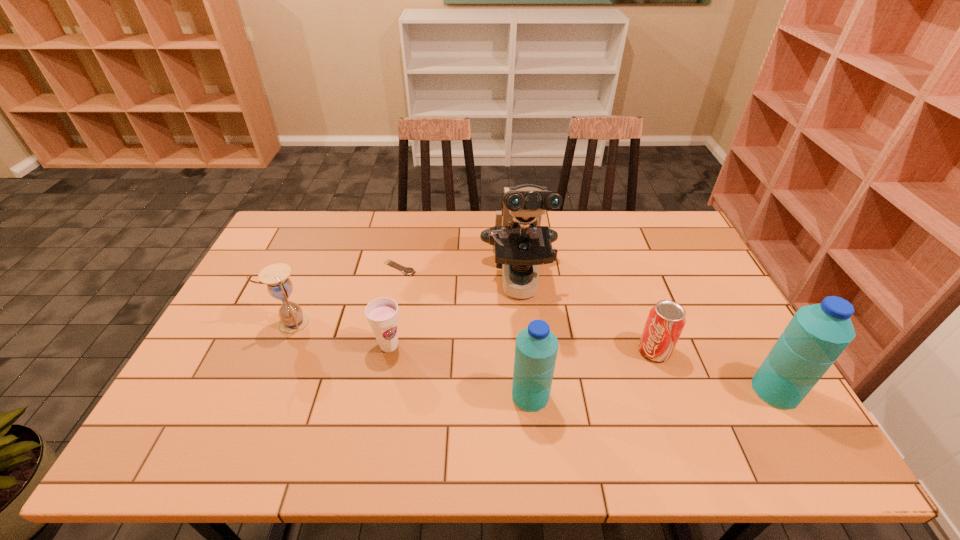
The height and width of the screenshot is (540, 960). I want to click on vacant space positioned on the back of the taller water bottle, so click(709, 275).

At what (x,y) coordinates should I click in order to perform the action: click on free space located on the right of the watch. Please return your answer as a coordinate pair (x, y). Looking at the image, I should click on (457, 268).

Identify the location of free space located 0.360m on the right of the cup. (538, 346).

Where is `vacant space located 0.280m on the back of the leftmost object`? The image size is (960, 540). vacant space located 0.280m on the back of the leftmost object is located at coordinates (324, 252).

Locate an element on the screen. The height and width of the screenshot is (540, 960). free space located on the right of the soda can is located at coordinates (734, 351).

Where is `vacant space located 0.280m through the eyepieces of the microscope`? The width and height of the screenshot is (960, 540). vacant space located 0.280m through the eyepieces of the microscope is located at coordinates (533, 416).

Find the location of `object that is at the far edge`. object that is at the far edge is located at coordinates (520, 242).

At what (x,y) coordinates should I click in order to perform the action: click on object present at the left edge. Please return your answer as a coordinate pair (x, y). Looking at the image, I should click on coord(293,320).

Find the location of a particular element. This screenshot has height=540, width=960. object situated at the right edge is located at coordinates (817, 334).

I want to click on object at the near right corner, so click(817, 334).